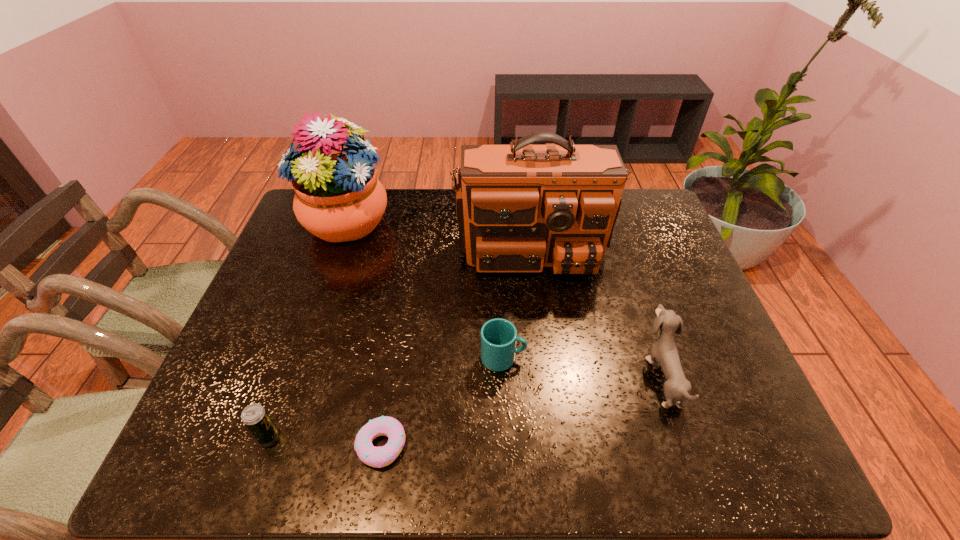
Where is `vacant region located at the face of the puppy`? This screenshot has height=540, width=960. vacant region located at the face of the puppy is located at coordinates (482, 376).

At what (x,y) coordinates should I click in order to perform the action: click on free region located 0.250m at the face of the puppy. Please return your answer as a coordinate pair (x, y). The height and width of the screenshot is (540, 960). Looking at the image, I should click on (540, 376).

Identify the location of free space located 0.280m on the handle side of the cup. Image resolution: width=960 pixels, height=540 pixels. (644, 358).

Image resolution: width=960 pixels, height=540 pixels. I want to click on free point located 0.320m on the back of the beer can, so click(312, 310).

Where is `vacant space located on the back of the third object from left to right`? vacant space located on the back of the third object from left to right is located at coordinates (405, 296).

Locate an element on the screen. satchel present at the far edge is located at coordinates (520, 207).

The height and width of the screenshot is (540, 960). I want to click on flower arrangement present at the far edge, so click(338, 198).

Locate an element on the screen. This screenshot has height=540, width=960. beer can that is at the near edge is located at coordinates (256, 419).

The height and width of the screenshot is (540, 960). Find the location of `doughnut that is at the near edge`. doughnut that is at the near edge is located at coordinates click(x=378, y=457).

Where is `flower arrangement that is at the left edge`? The height and width of the screenshot is (540, 960). flower arrangement that is at the left edge is located at coordinates click(338, 198).